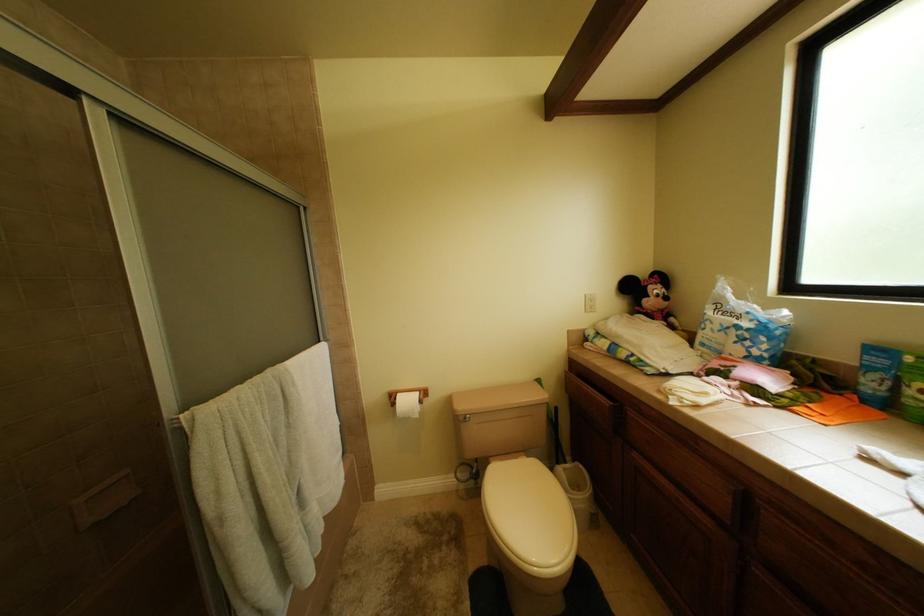
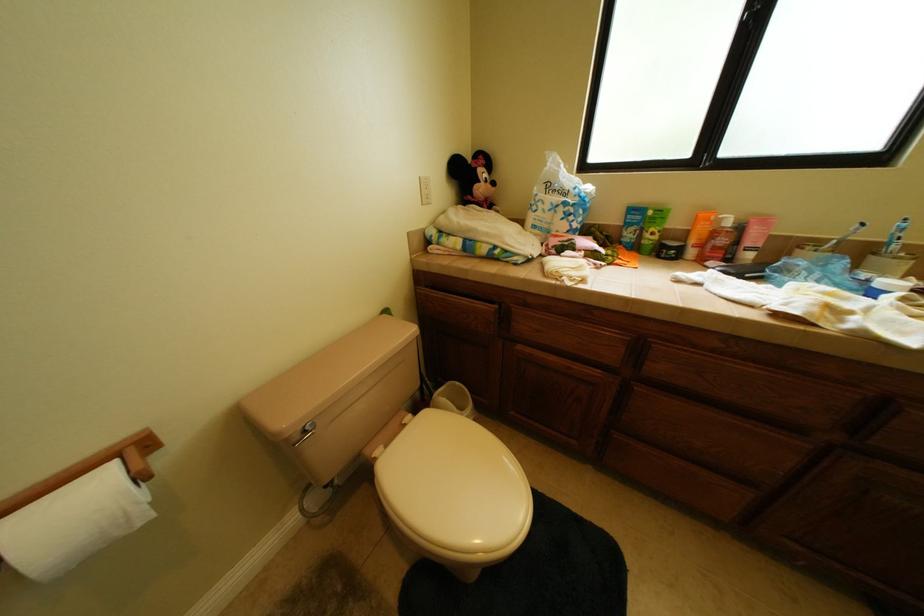
The first image is from the beginning of the video and the second image is from the end. How did the camera likely rotate when shooting the video?

The camera's rotation is toward right-down.